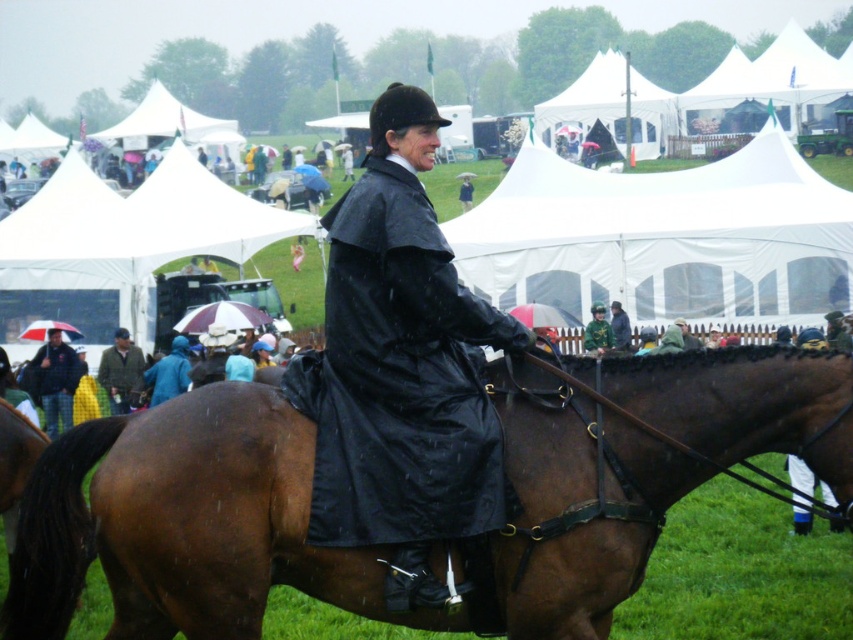
Question: Which of these objects is positioned closest to the white canvas tent at upper center?

Choices:
 (A) white fabric tent at center
 (B) brown glossy horse at center
 (C) green fabric jacket at center
 (D) camouflage fabric jacket at lower left

Answer: (C)

Question: From the image, what is the correct spatial relationship of brown glossy horse at center in relation to plaid fabric jacket at lower left?

Choices:
 (A) below
 (B) above

Answer: (B)

Question: Which point is farther from the camera taking this photo?

Choices:
 (A) (595, 312)
 (B) (509, 627)
 (C) (50, 433)
 (D) (135, 358)

Answer: (A)

Question: Does brown glossy horse at center appear on the right side of plaid fabric jacket at lower left?

Choices:
 (A) yes
 (B) no

Answer: (A)

Question: Considering the relative positions of plaid fabric jacket at lower left and green fabric jacket at center in the image provided, where is plaid fabric jacket at lower left located with respect to green fabric jacket at center?

Choices:
 (A) left
 (B) right

Answer: (A)

Question: Based on their relative distances, which object is nearer to the plaid fabric jacket at lower left?

Choices:
 (A) white canvas tent at upper center
 (B) white fabric tent at center
 (C) brown glossy horse at center

Answer: (B)